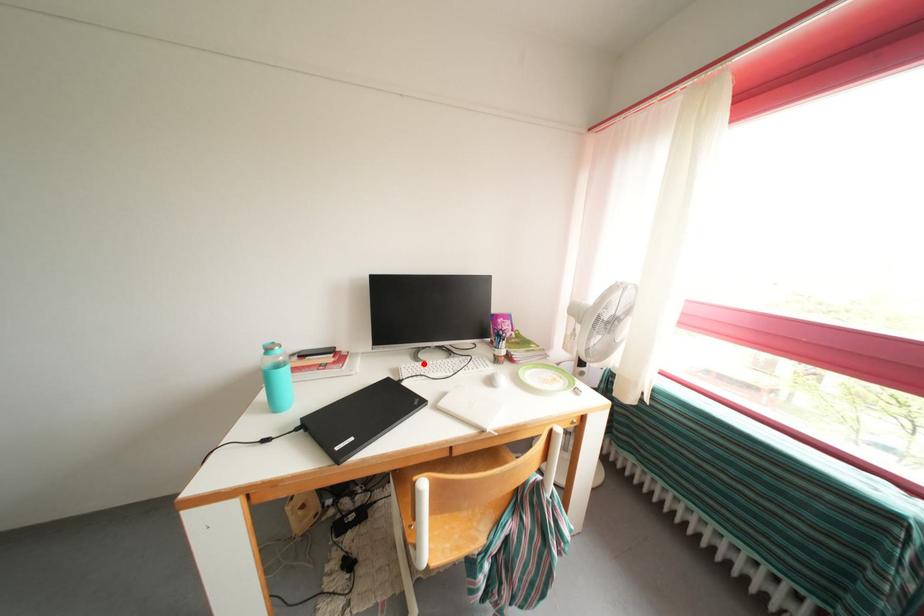
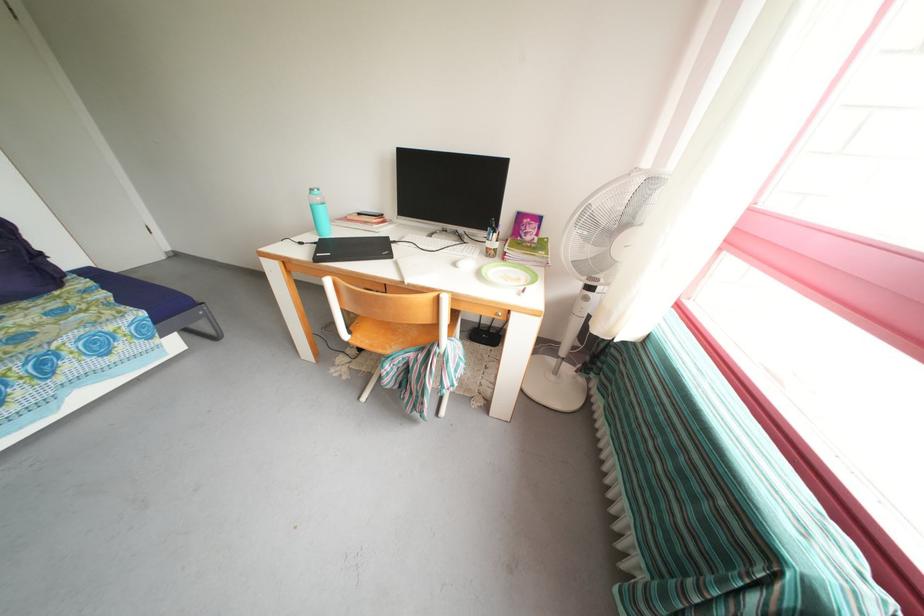
In the second image, find the point that corresponds to the highlighted location in the first image.

(436, 241)